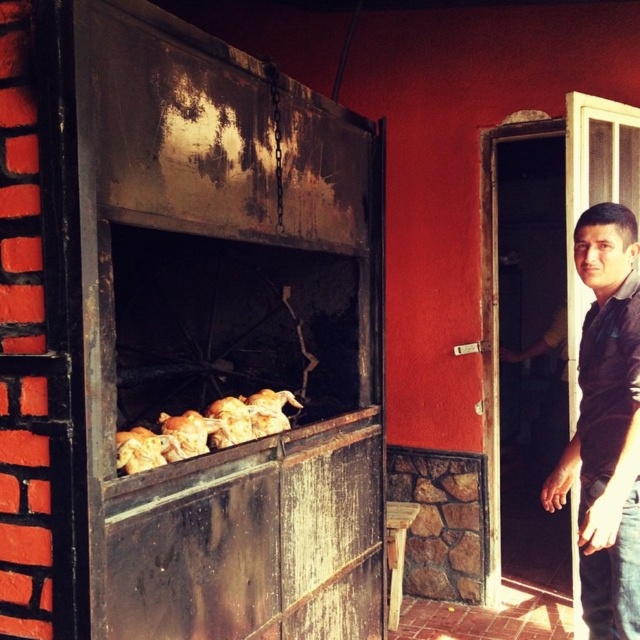
Question: Which point is closer to the camera?

Choices:
 (A) (150, 451)
 (B) (237, 412)
 (C) (172, 428)
 (D) (588, 374)

Answer: (A)

Question: Among these objects, which one is nearest to the camera?

Choices:
 (A) golden crispy chicken at lower left
 (B) golden crispy chicken at center
 (C) black shirt at right
 (D) golden brown crispy chicken at center

Answer: (D)

Question: Which object appears farthest from the camera in this image?

Choices:
 (A) golden crispy chicken at lower left
 (B) golden brown crispy chicken at center
 (C) golden crispy chicken at center

Answer: (C)

Question: Does golden brown crispy chicken at center appear on the left side of golden crispy chicken at lower left?

Choices:
 (A) no
 (B) yes

Answer: (A)

Question: Considering the relative positions of golden crispy chicken at center and golden crispy chicken at lower left in the image provided, where is golden crispy chicken at center located with respect to golden crispy chicken at lower left?

Choices:
 (A) below
 (B) above

Answer: (A)

Question: Is golden brown crispy chicken at center to the left of golden crispy chicken at center from the viewer's perspective?

Choices:
 (A) yes
 (B) no

Answer: (B)